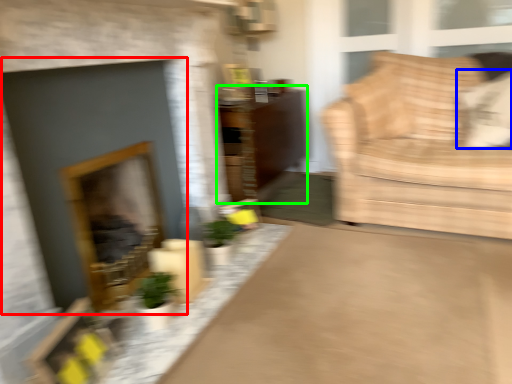
Question: Which is nearer to the fireplace (highlighted by a red box)? pillow (highlighted by a blue box) or dresser (highlighted by a green box).

Choices:
 (A) pillow
 (B) dresser

Answer: (B)